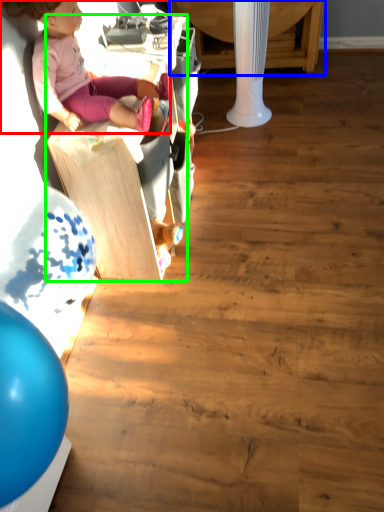
Question: Based on their relative distances, which object is farther from person (highlighted by a red box)? Choose from table (highlighted by a blue box) and furniture (highlighted by a green box).

Choices:
 (A) table
 (B) furniture

Answer: (A)